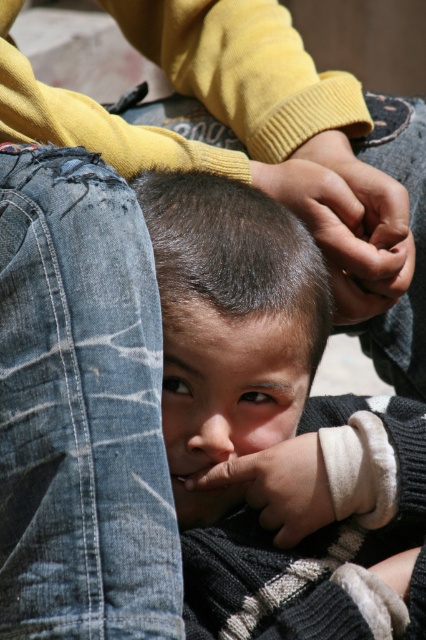
Does dark skin/hands at center have a larger size compared to smooth skin forehead at center?

Yes, dark skin/hands at center is bigger than smooth skin forehead at center.

In the scene shown: Can you confirm if dark skin/hands at center is positioned above smooth skin forehead at center?

Indeed, dark skin/hands at center is positioned over smooth skin forehead at center.

Measure the distance between dark skin/hands at center and camera.

A distance of 1.19 meters exists between dark skin/hands at center and camera.

Locate an element on the screen. The image size is (426, 640). dark skin/hands at center is located at coordinates (347, 221).

Is blue denim jeans at left below dark brown hair at center?

Yes.

Can you confirm if blue denim jeans at left is bigger than dark brown hair at center?

Correct, blue denim jeans at left is larger in size than dark brown hair at center.

Between point (161, 600) and point (281, 308), which one is positioned behind?

The point (281, 308) is more distant.

Locate an element on the screen. Image resolution: width=426 pixels, height=640 pixels. blue denim jeans at left is located at coordinates (80, 406).

Does smooth skin child at center have a larger size compared to blue denim jeans at left?

Indeed, smooth skin child at center has a larger size compared to blue denim jeans at left.

Does smooth skin child at center come in front of blue denim jeans at left?

No, it is behind blue denim jeans at left.

Is point (175, 440) positioned before point (132, 385)?

No, it is behind (132, 385).

Locate an element on the screen. The width and height of the screenshot is (426, 640). smooth skin child at center is located at coordinates (271, 426).